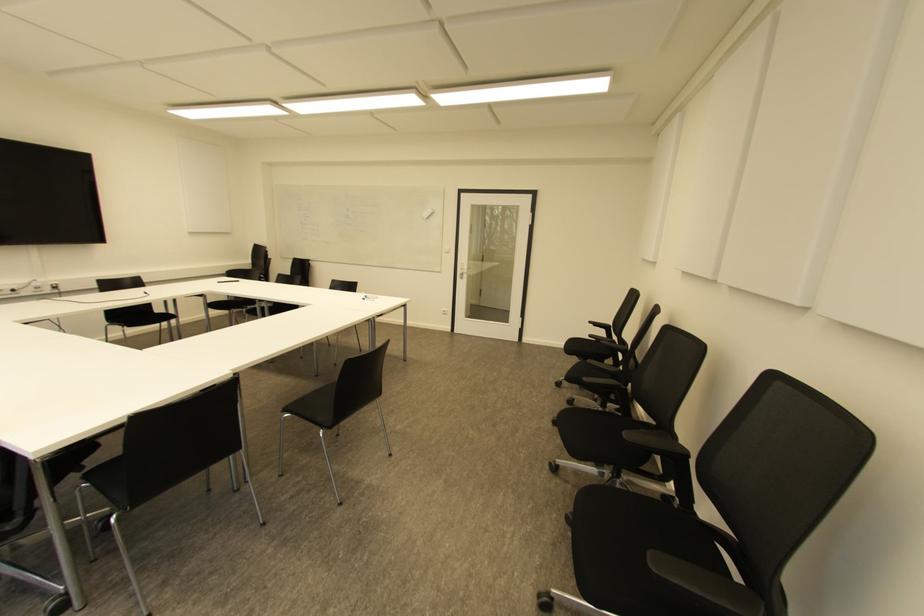
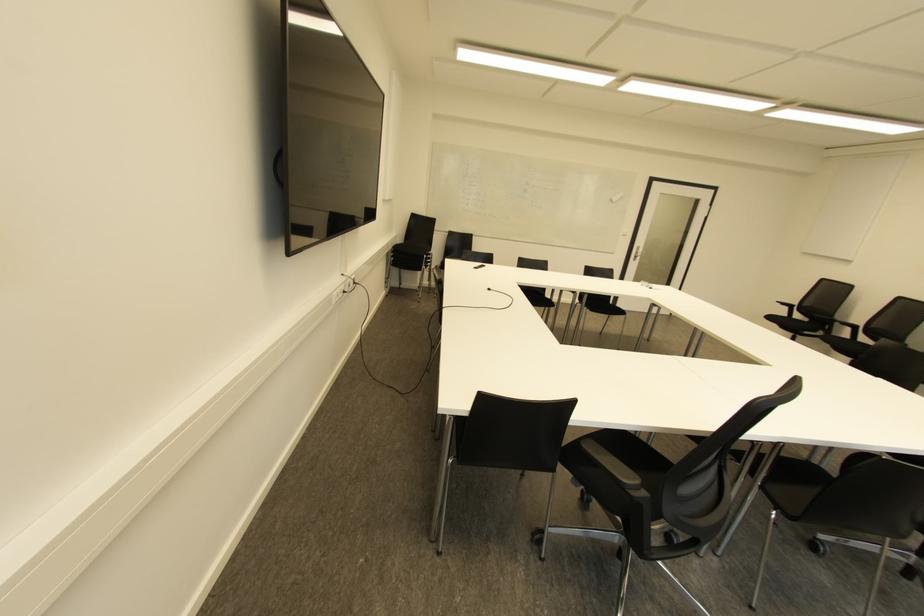
In the second image, find the point that corresponds to (x=55, y=286) in the first image.

(354, 282)